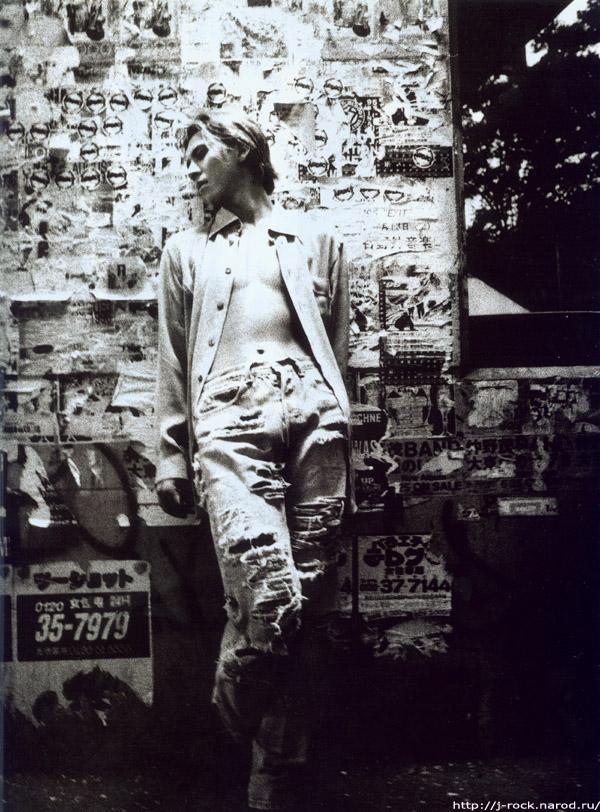
Locate an element on the screen. papers is located at coordinates (386, 434).